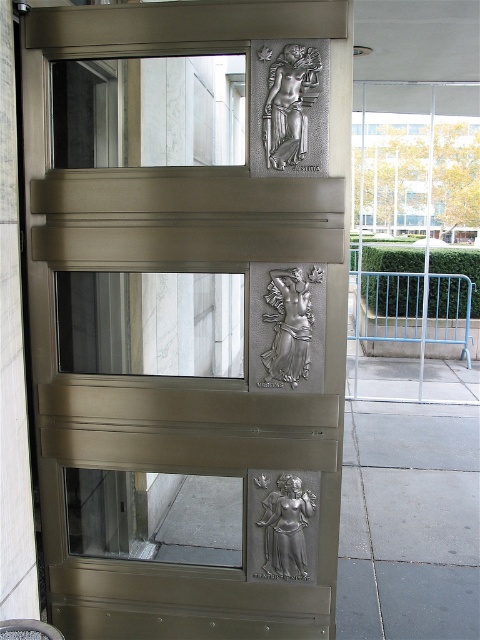
Question: Which point is farther to the camera?

Choices:
 (A) (287, 368)
 (B) (305, 72)
 (C) (443, 218)

Answer: (C)

Question: Does polished bronze elevator at center have a greater width compared to silver metallic relief at upper center?

Choices:
 (A) no
 (B) yes

Answer: (B)

Question: Does transparent glass door at right appear on the right side of silver metallic relief at lower center?

Choices:
 (A) yes
 (B) no

Answer: (A)

Question: Which of the following is the farthest from the observer?

Choices:
 (A) transparent glass door at right
 (B) gray concrete pavement at lower right
 (C) silver metallic relief at center-right
 (D) silver metallic relief at lower center

Answer: (A)

Question: Does silver metallic relief at center-right appear over silver metallic relief at lower center?

Choices:
 (A) yes
 (B) no

Answer: (A)

Question: Which object is positioned closest to the silver metallic relief at lower center?

Choices:
 (A) silver metallic relief at upper center
 (B) polished bronze elevator at center
 (C) transparent glass door at right

Answer: (B)